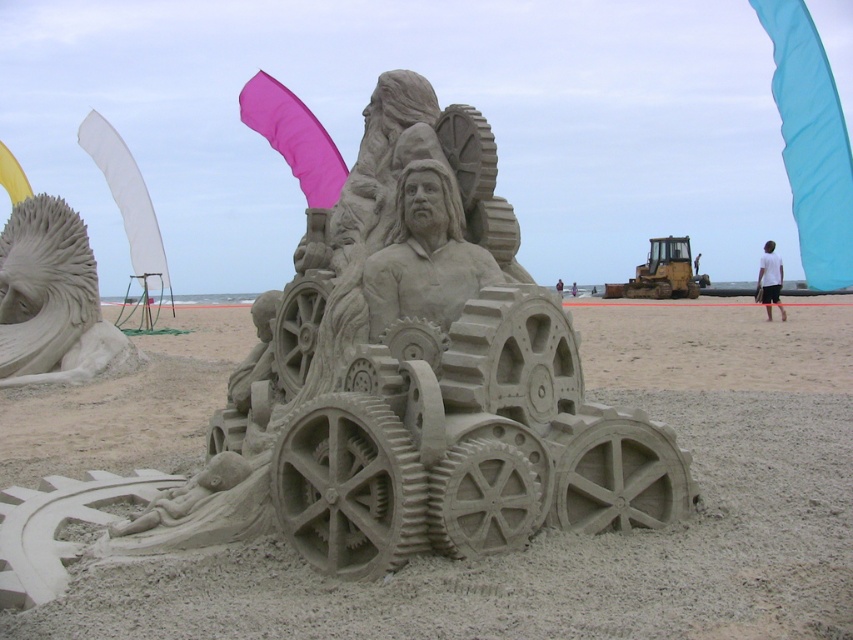
Question: Considering the real-world distances, which object is closest to the sand sculpture at center?

Choices:
 (A) sandstone gears at center
 (B) smooth sand lion at left

Answer: (A)

Question: Which point is farther to the camera?

Choices:
 (A) (769, 580)
 (B) (480, 212)
 (C) (64, 268)

Answer: (C)

Question: Does sandstone gears at center appear under sand sculpture at center?

Choices:
 (A) yes
 (B) no

Answer: (A)

Question: From the image, what is the correct spatial relationship of sandstone gears at center in relation to sand sculpture at center?

Choices:
 (A) below
 (B) above

Answer: (A)

Question: Can you confirm if sandstone gears at center is positioned below smooth sand lion at left?

Choices:
 (A) yes
 (B) no

Answer: (A)

Question: Considering the real-world distances, which object is farthest from the sandstone gears at center?

Choices:
 (A) smooth sand lion at left
 (B) sand sculpture at center

Answer: (A)